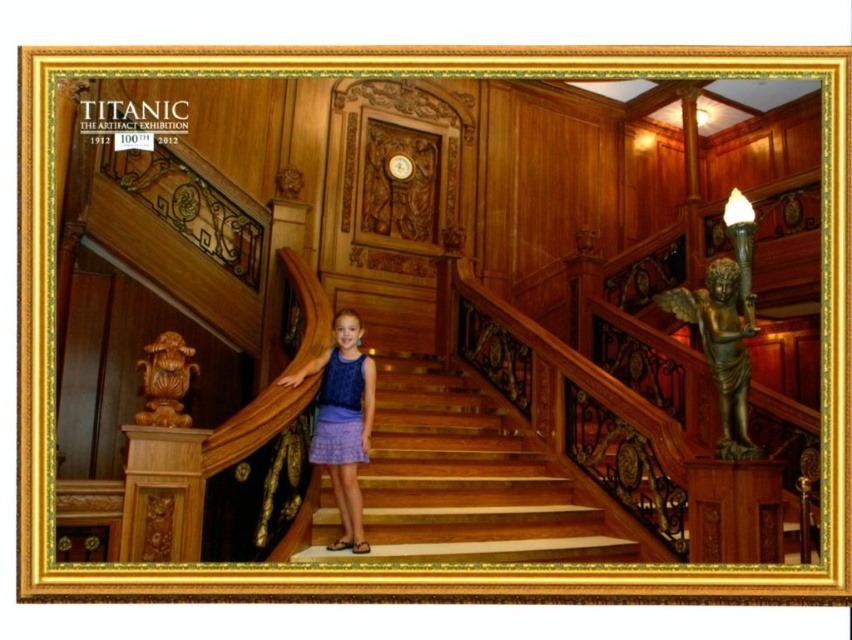
You are standing at the bottom of the staircase in the Titanic exhibition and see two points marked on the floor. One is at point (590, 524) and the other at point (331, 348). If you want to walk towards the point that is further away from you, which coordinate should you head towards?

Point (590, 524) is behind point (331, 348), so you should head towards point (590, 524) as it is further away from your current position at the bottom of the staircase.

Looking at this image, you are an interior designer assessing the Titanic exhibit. You need to place a small decorative vase on the staircase. Considering the size of the wooden stairs at center and the lavender fabric skirt at center, which object would be more suitable for placing the vase?

The wooden stairs at center has a larger size compared to the lavender fabric skirt at center, so the wooden stairs at center would be more suitable for placing the vase.

You are a photographer setting up a shoot in the Titanic artifact exhibition. You need to position a camera on the wooden stairs at center to capture the lavender fabric skirt at center. Given their heights, which object should be placed higher to ensure the camera can capture the skirt properly?

The lavender fabric skirt at center is taller than the wooden stairs at center. Therefore, the camera should be placed higher on the wooden stairs at center to capture the lavender fabric skirt at center properly.